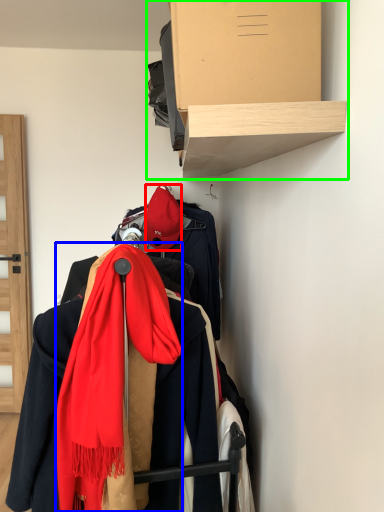
Question: Considering the real-world distances, which object is farthest from hat (highlighted by a red box)? scarf (highlighted by a blue box) or shelf (highlighted by a green box)?

Choices:
 (A) scarf
 (B) shelf

Answer: (A)